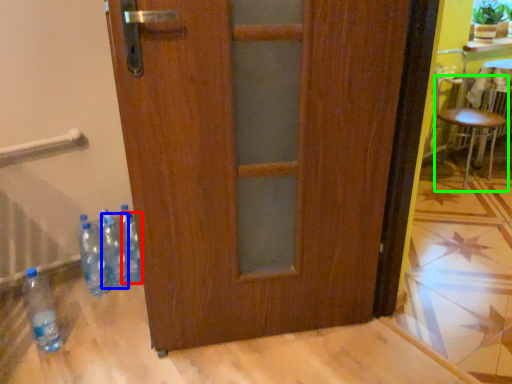
Question: Estimate the real-world distances between objects in this image. Which object is farther from bottle (highlighted by a red box), bottle (highlighted by a blue box) or chair (highlighted by a green box)?

Choices:
 (A) bottle
 (B) chair

Answer: (B)